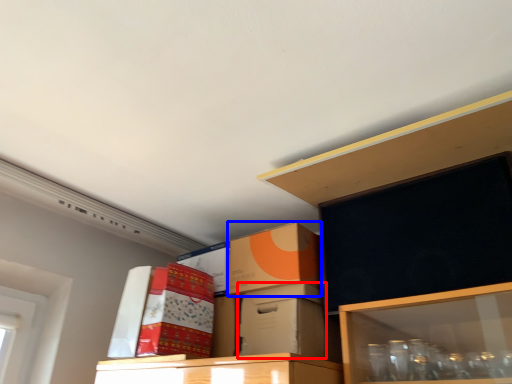
Question: Which of the following is the farthest to the observer, box (highlighted by a red box) or box (highlighted by a blue box)?

Choices:
 (A) box
 (B) box

Answer: (B)